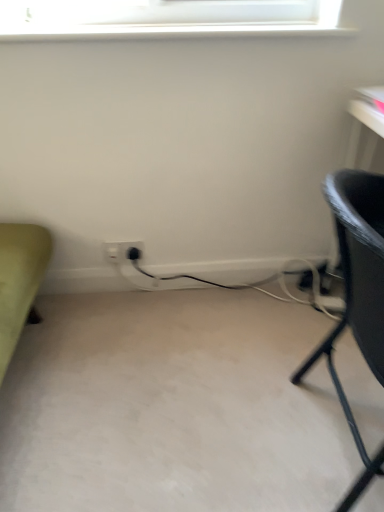
Question: Is black plastic plug at lower center located within black textured chair at right?

Choices:
 (A) yes
 (B) no

Answer: (B)

Question: Is black textured chair at right taller than black plastic plug at lower center?

Choices:
 (A) no
 (B) yes

Answer: (B)

Question: Can you confirm if black textured chair at right is positioned to the right of black plastic plug at lower center?

Choices:
 (A) yes
 (B) no

Answer: (A)

Question: From a real-world perspective, is black textured chair at right on black plastic plug at lower center?

Choices:
 (A) yes
 (B) no

Answer: (A)

Question: From the image's perspective, is black textured chair at right located above black plastic plug at lower center?

Choices:
 (A) no
 (B) yes

Answer: (A)

Question: Considering the positions of black textured chair at right and white plastic electric outlet at center, arranged as the 2th electric outlet when viewed from the right, in the image, is black textured chair at right bigger or smaller than white plastic electric outlet at center, arranged as the 2th electric outlet when viewed from the right,?

Choices:
 (A) small
 (B) big

Answer: (B)

Question: From the image's perspective, relative to white plastic electric outlet at center, which is the 1th electric outlet from left to right, is black textured chair at right above or below?

Choices:
 (A) below
 (B) above

Answer: (A)

Question: Is point (382, 298) closer or farther from the camera than point (104, 250)?

Choices:
 (A) farther
 (B) closer

Answer: (B)

Question: Would you say black textured chair at right is to the left or to the right of white plastic electric outlet at center, arranged as the 2th electric outlet when viewed from the right, in the picture?

Choices:
 (A) left
 (B) right

Answer: (B)

Question: Would you say white plastic electric outlet at center, arranged as the 2th electric outlet when viewed from the right, is inside or outside black plastic plug at lower center?

Choices:
 (A) outside
 (B) inside

Answer: (A)

Question: From a real-world perspective, is white plastic electric outlet at center, arranged as the 2th electric outlet when viewed from the right, positioned above or below black plastic plug at lower center?

Choices:
 (A) above
 (B) below

Answer: (B)

Question: Considering the positions of white plastic electric outlet at center, arranged as the 2th electric outlet when viewed from the right, and black plastic plug at lower center in the image, is white plastic electric outlet at center, arranged as the 2th electric outlet when viewed from the right, bigger or smaller than black plastic plug at lower center?

Choices:
 (A) small
 (B) big

Answer: (A)

Question: Considering their positions, is white plastic electric outlet at center, arranged as the 2th electric outlet when viewed from the right, located in front of or behind black plastic plug at lower center?

Choices:
 (A) behind
 (B) front

Answer: (A)

Question: From the image's perspective, is black textured chair at right located above or below white plastic electric outlet at lower center, positioned as the first electric outlet in right-to-left order?

Choices:
 (A) above
 (B) below

Answer: (B)

Question: In terms of width, does black textured chair at right look wider or thinner when compared to white plastic electric outlet at lower center, the 2th electric outlet positioned from the left?

Choices:
 (A) thin
 (B) wide

Answer: (B)